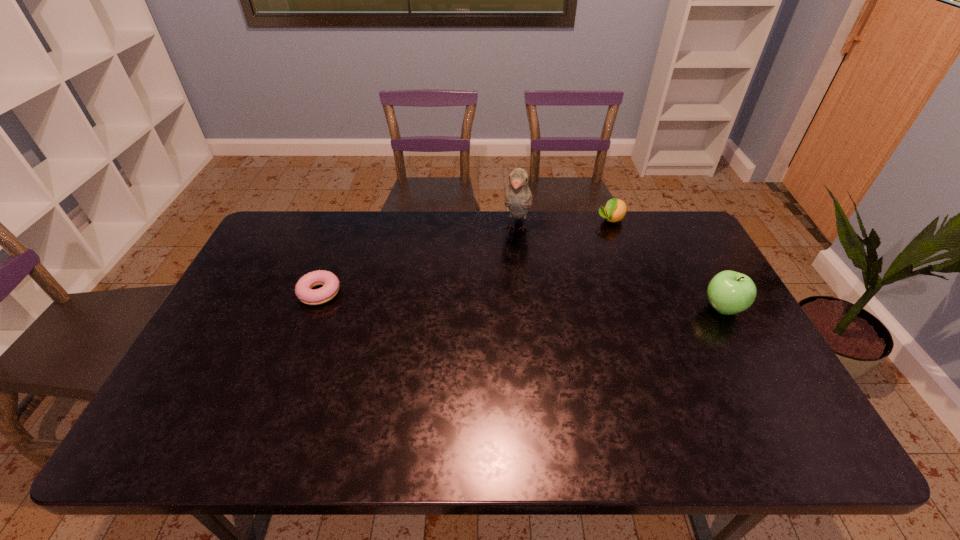
In order to click on vacant space at the near edge in this screenshot , I will do `click(639, 399)`.

Find the location of `vacant space at the right edge of the desktop`. vacant space at the right edge of the desktop is located at coordinates (733, 331).

The image size is (960, 540). I want to click on vacant point at the far left corner, so (284, 222).

The height and width of the screenshot is (540, 960). Find the location of `free space at the near right corner of the desktop`. free space at the near right corner of the desktop is located at coordinates (724, 394).

Where is `vacant area that lies between the third object from right to left and the apple`? The height and width of the screenshot is (540, 960). vacant area that lies between the third object from right to left and the apple is located at coordinates (619, 268).

Locate an element on the screen. The height and width of the screenshot is (540, 960). free space between the second shortest object and the leftmost object is located at coordinates (466, 256).

Image resolution: width=960 pixels, height=540 pixels. I want to click on free spot between the third tallest object and the leftmost object, so [x=466, y=256].

The image size is (960, 540). What are the coordinates of `vacant space that's between the leftmost object and the bird` in the screenshot? It's located at (418, 261).

Where is `empty location between the tallest object and the apple`? This screenshot has width=960, height=540. empty location between the tallest object and the apple is located at coordinates (619, 268).

At what (x,y) coordinates should I click in order to perform the action: click on vacant space in between the leftmost object and the third tallest object. Please return your answer as a coordinate pair (x, y). The height and width of the screenshot is (540, 960). Looking at the image, I should click on (466, 256).